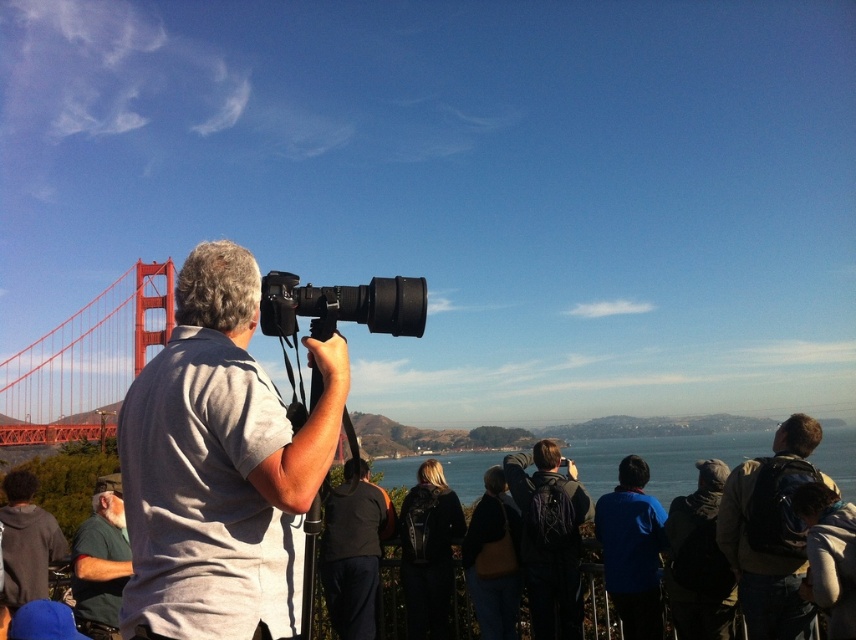
Question: Is gray fabric shirt at center above bright orange bridge at left?

Choices:
 (A) yes
 (B) no

Answer: (A)

Question: Which of the following is the farthest from the observer?

Choices:
 (A) dark blue backpack at center
 (B) dark gray backpack at center right

Answer: (A)

Question: Does dark blue backpack at center have a greater width compared to green fabric shirt at lower left?

Choices:
 (A) no
 (B) yes

Answer: (A)

Question: Considering the relative positions of gray fabric shirt at center and bright orange bridge at left in the image provided, where is gray fabric shirt at center located with respect to bright orange bridge at left?

Choices:
 (A) below
 (B) above

Answer: (B)

Question: Which object is closer to the camera taking this photo?

Choices:
 (A) gray fabric shirt at center
 (B) black plastic camera at center
 (C) blue water at center

Answer: (A)

Question: Estimate the real-world distances between objects in this image. Which object is farther from the dark blue backpack at center?

Choices:
 (A) dark gray backpack at center right
 (B) blue water at center
 (C) gray fabric shirt at center

Answer: (B)